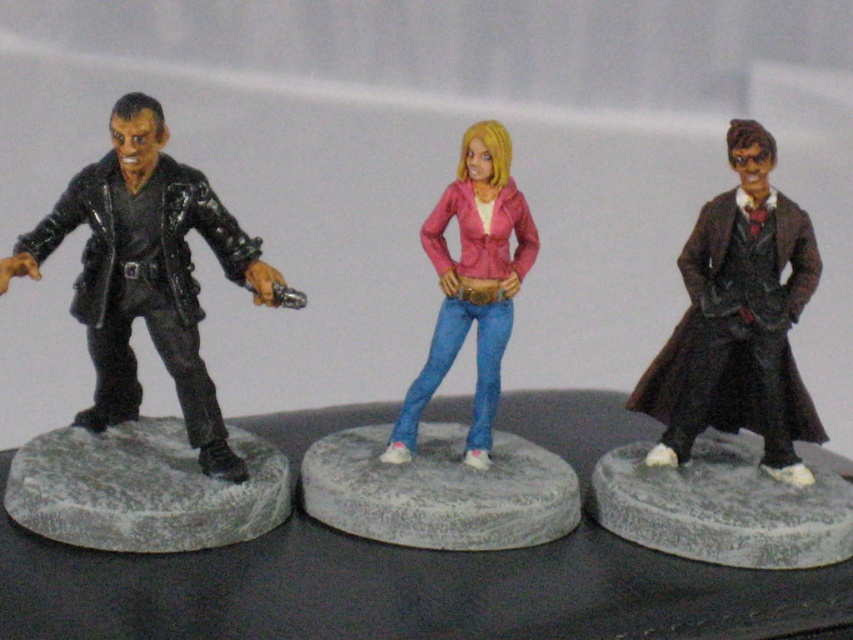
The image size is (853, 640). What do you see at coordinates (148, 273) in the screenshot?
I see `shiny black figure at left` at bounding box center [148, 273].

Based on the photo, is shiny black figure at left smaller than shiny brown coat at right?

No, shiny black figure at left is not smaller than shiny brown coat at right.

Does point (215, 244) lie in front of point (755, 288)?

Yes.

Locate an element on the screen. shiny black figure at left is located at coordinates (148, 273).

Between shiny brown coat at right and pink matte jacket at center, which one is positioned lower?

shiny brown coat at right

Who is more distant from viewer, (799, 380) or (483, 221)?

Positioned behind is point (799, 380).

Who is more distant from viewer, (688, 438) or (495, 387)?

The point (688, 438) is more distant.

The width and height of the screenshot is (853, 640). Identify the location of shiny brown coat at right. (738, 321).

Between shiny brown coat at right and gray concrete base at left, which one has more height?

With more height is shiny brown coat at right.

Is shiny brown coat at right taller than gray concrete base at left?

Yes.

Between point (662, 394) and point (170, 474), which one is positioned behind?

The point (662, 394) is more distant.

You are a GUI agent. You are given a task and a screenshot of the screen. Output one action in this format:
    pyautogui.click(x=<x>, y=<y>)
    Task: Click on the shiny brown coat at right
    
    Given the screenshot: What is the action you would take?
    pyautogui.click(x=738, y=321)